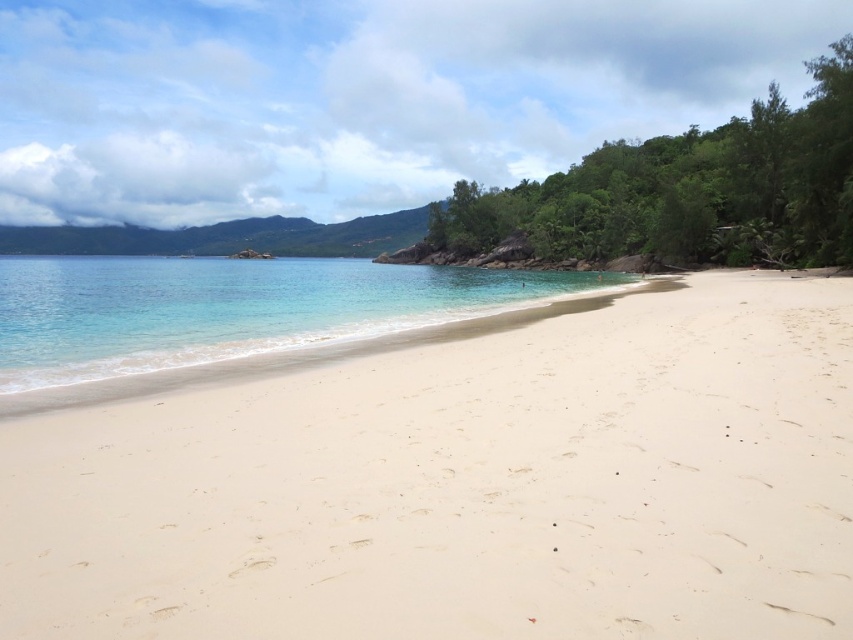
Can you confirm if white sand at center is positioned below clear water at center?

Indeed, white sand at center is positioned under clear water at center.

Between white sand at center and clear water at center, which one appears on the left side from the viewer's perspective?

clear water at center

Where is `white sand at center`? This screenshot has width=853, height=640. white sand at center is located at coordinates (465, 484).